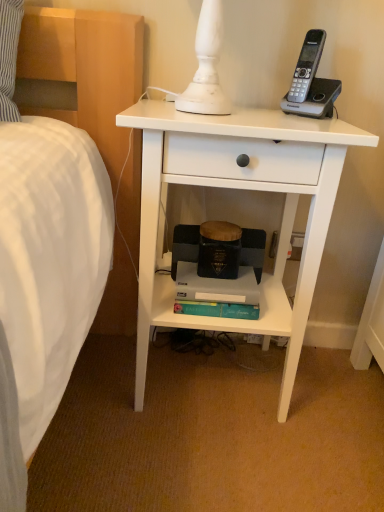
Question: Is white matte nightstand at center closer to camera compared to teal matte paperback book at lower center?

Choices:
 (A) no
 (B) yes

Answer: (B)

Question: Considering the relative sizes of white matte nightstand at center and teal matte paperback book at lower center in the image provided, is white matte nightstand at center taller than teal matte paperback book at lower center?

Choices:
 (A) no
 (B) yes

Answer: (B)

Question: Is white matte nightstand at center shorter than teal matte paperback book at lower center?

Choices:
 (A) yes
 (B) no

Answer: (B)

Question: From a real-world perspective, does white matte nightstand at center sit lower than teal matte paperback book at lower center?

Choices:
 (A) yes
 (B) no

Answer: (B)

Question: From the image's perspective, is white matte nightstand at center on teal matte paperback book at lower center?

Choices:
 (A) no
 (B) yes

Answer: (B)

Question: Is white matte nightstand at center next to teal matte paperback book at lower center?

Choices:
 (A) no
 (B) yes

Answer: (A)

Question: Is teal matte paperback book at lower center beside white matte nightstand at center?

Choices:
 (A) no
 (B) yes

Answer: (A)

Question: Is teal matte paperback book at lower center completely or partially outside of white matte nightstand at center?

Choices:
 (A) yes
 (B) no

Answer: (B)

Question: Is teal matte paperback book at lower center wider than white matte nightstand at center?

Choices:
 (A) no
 (B) yes

Answer: (A)

Question: Could white matte nightstand at center be considered to be inside teal matte paperback book at lower center?

Choices:
 (A) no
 (B) yes

Answer: (A)

Question: Considering the relative sizes of teal matte paperback book at lower center and white matte nightstand at center in the image provided, is teal matte paperback book at lower center bigger than white matte nightstand at center?

Choices:
 (A) no
 (B) yes

Answer: (A)

Question: Considering the relative positions of teal matte paperback book at lower center and white matte nightstand at center in the image provided, is teal matte paperback book at lower center in front of white matte nightstand at center?

Choices:
 (A) yes
 (B) no

Answer: (B)

Question: Based on their sizes in the image, would you say white matte nightstand at center is bigger or smaller than teal matte paperback book at lower center?

Choices:
 (A) big
 (B) small

Answer: (A)